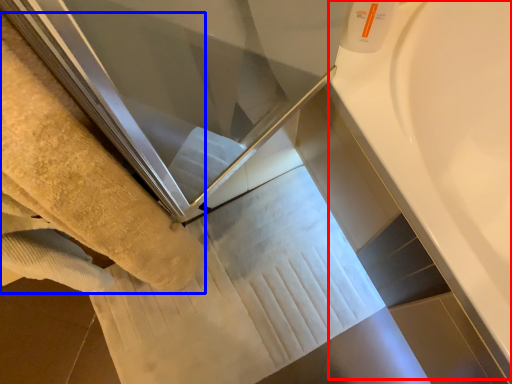
Question: Which object appears closest to the camera in this image, bath (highlighted by a red box) or towel (highlighted by a blue box)?

Choices:
 (A) bath
 (B) towel

Answer: (B)